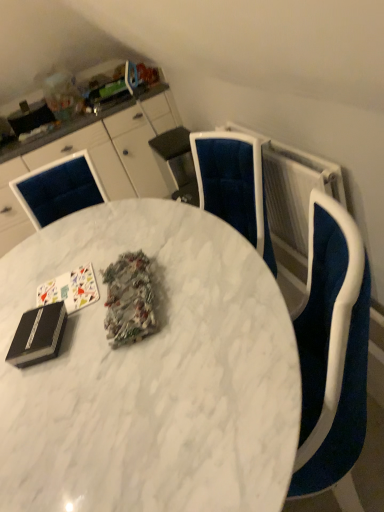
Question: Is white textured radiator at upper right taller or shorter than white glossy cabinets at upper left?

Choices:
 (A) short
 (B) tall

Answer: (A)

Question: Based on their positions, is white textured radiator at upper right located to the left or right of white glossy cabinets at upper left?

Choices:
 (A) left
 (B) right

Answer: (B)

Question: Based on their relative distances, which object is farther from the black matte binder at lower left?

Choices:
 (A) shiny metallic foil at center
 (B) white glossy cabinets at upper left
 (C) white matte card game at upper left
 (D) white textured radiator at upper right
 (E) white marble table at center

Answer: (B)

Question: Which object is positioned farthest from the shiny metallic foil at center?

Choices:
 (A) white matte card game at upper left
 (B) white glossy cabinets at upper left
 (C) white textured radiator at upper right
 (D) black matte binder at lower left
 (E) white marble table at center

Answer: (B)